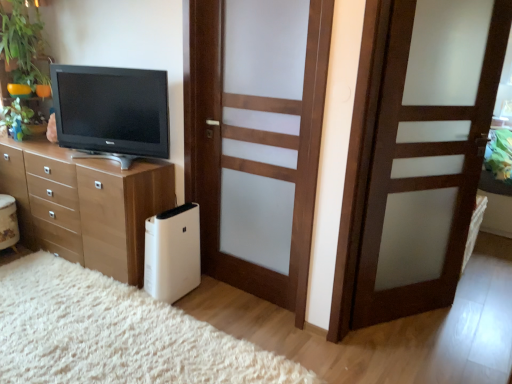
Question: From the image's perspective, is wooden door at center, acting as the first door starting from the right, on wooden door with frosted glass at center, marked as the 2th door in a right-to-left arrangement?

Choices:
 (A) no
 (B) yes

Answer: (A)

Question: Can you confirm if wooden door at center, the 2th door when ordered from left to right, is smaller than wooden door with frosted glass at center, marked as the 2th door in a right-to-left arrangement?

Choices:
 (A) yes
 (B) no

Answer: (B)

Question: Would you say wooden door with frosted glass at center, marked as the 2th door in a right-to-left arrangement, is part of wooden door at center, acting as the first door starting from the right,'s contents?

Choices:
 (A) no
 (B) yes

Answer: (A)

Question: Are wooden door at center, acting as the first door starting from the right, and wooden door with frosted glass at center, marked as the 2th door in a right-to-left arrangement, making contact?

Choices:
 (A) no
 (B) yes

Answer: (A)

Question: Can you confirm if wooden door at center, acting as the first door starting from the right, is taller than wooden door with frosted glass at center, marked as the 2th door in a right-to-left arrangement?

Choices:
 (A) yes
 (B) no

Answer: (A)

Question: Do you think green leafy plant at upper left, the second plant in the bottom-to-top sequence, is within green glossy plant at upper left, placed as the 1th plant when sorted from bottom to top, or outside of it?

Choices:
 (A) outside
 (B) inside

Answer: (A)

Question: Is green leafy plant at upper left, the second plant in the bottom-to-top sequence, bigger or smaller than green glossy plant at upper left, the 2th plant in the top-to-bottom sequence?

Choices:
 (A) small
 (B) big

Answer: (B)

Question: Would you say green leafy plant at upper left, acting as the first plant starting from the top, is to the left or to the right of green glossy plant at upper left, placed as the 1th plant when sorted from bottom to top, in the picture?

Choices:
 (A) right
 (B) left

Answer: (A)

Question: Considering the positions of green leafy plant at upper left, acting as the first plant starting from the top, and green glossy plant at upper left, the 2th plant in the top-to-bottom sequence, in the image, is green leafy plant at upper left, acting as the first plant starting from the top, wider or thinner than green glossy plant at upper left, the 2th plant in the top-to-bottom sequence,?

Choices:
 (A) wide
 (B) thin

Answer: (A)

Question: Visually, is matte black tv at left positioned to the left or to the right of light wood chest of drawers at left?

Choices:
 (A) right
 (B) left

Answer: (A)

Question: Is point (110, 77) positioned closer to the camera than point (102, 168)?

Choices:
 (A) closer
 (B) farther

Answer: (A)

Question: Is matte black tv at left wider or thinner than light wood chest of drawers at left?

Choices:
 (A) wide
 (B) thin

Answer: (B)

Question: Based on their sizes in the image, would you say matte black tv at left is bigger or smaller than light wood chest of drawers at left?

Choices:
 (A) big
 (B) small

Answer: (B)

Question: Is point (381, 13) positioned closer to the camera than point (139, 127)?

Choices:
 (A) closer
 (B) farther

Answer: (A)

Question: Considering the positions of wooden door at center, acting as the first door starting from the right, and matte black tv at left in the image, is wooden door at center, acting as the first door starting from the right, bigger or smaller than matte black tv at left?

Choices:
 (A) small
 (B) big

Answer: (B)